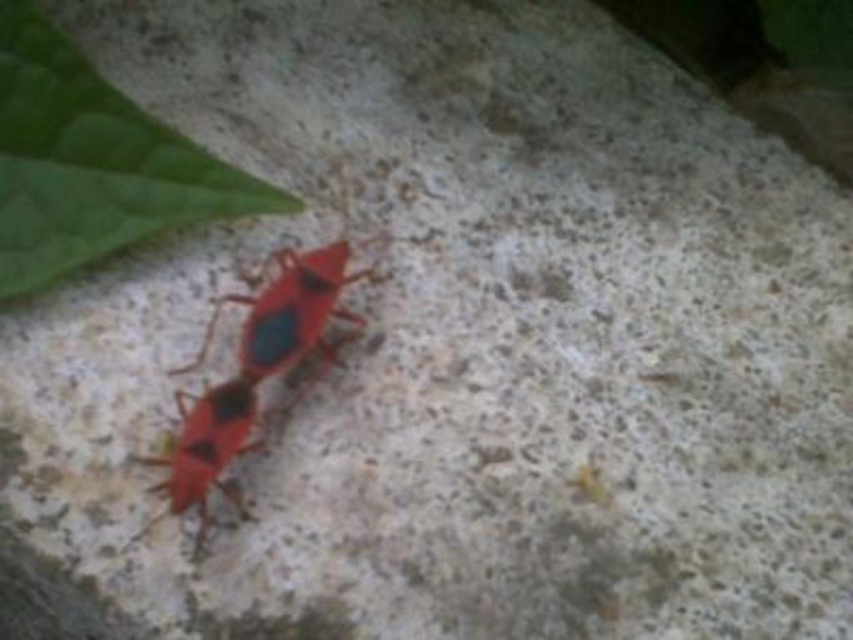
Based on the photo, is green matte leaf at upper left positioned before matte red bug at center?

No, green matte leaf at upper left is further to the viewer.

Between point (138, 122) and point (178, 372), which one is positioned behind?

Point (178, 372)

Where is `green matte leaf at upper left`? green matte leaf at upper left is located at coordinates (91, 161).